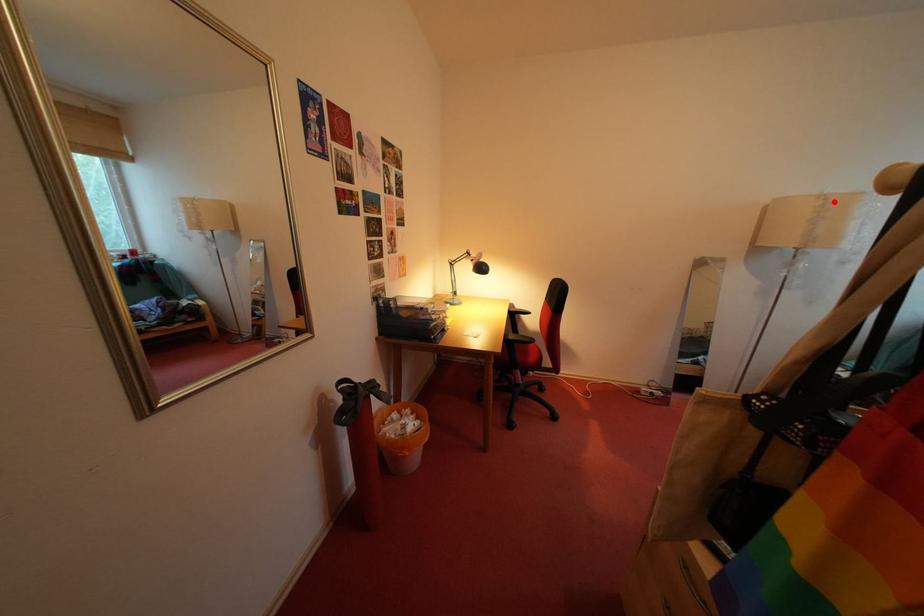
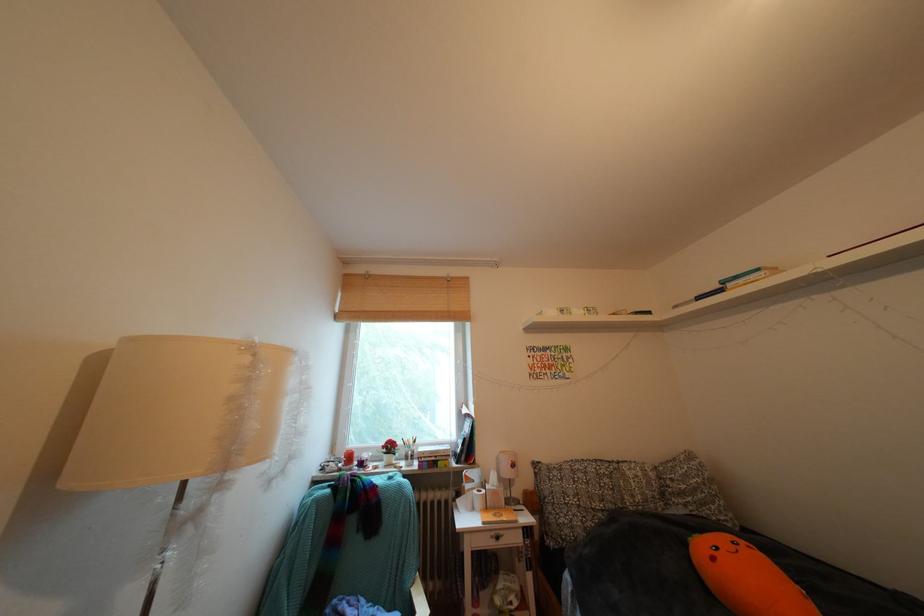
Question: I am providing you with two images of the same scene from different viewpoints. A red point is shown in image1. For the corresponding object point in image2, is it positioned nearer or farther from the camera?

Choices:
 (A) Nearer
 (B) Farther

Answer: (B)